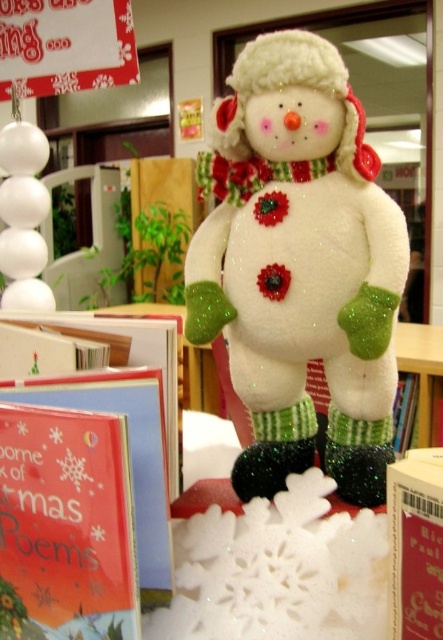
Can you confirm if fuzzy white snowman at center is shorter than matte red card at center?

Incorrect, fuzzy white snowman at center's height does not fall short of matte red card at center's.

Which is below, fuzzy white snowman at center or matte red card at center?

Positioned lower is matte red card at center.

Is point (265, 276) positioned behind point (15, 316)?

No, (265, 276) is in front of (15, 316).

This screenshot has width=443, height=640. I want to click on fuzzy white snowman at center, so click(299, 266).

Can you confirm if fuzzy white snowman at center is shorter than white paper book at center?

No, fuzzy white snowman at center is not shorter than white paper book at center.

Who is shorter, fuzzy white snowman at center or white paper book at center?

Standing shorter between the two is white paper book at center.

Does point (252, 422) come in front of point (403, 528)?

No.

The image size is (443, 640). I want to click on fuzzy white snowman at center, so click(299, 266).

Is point (170, 422) closer to camera compared to point (439, 589)?

No, it is not.

Describe the element at coordinates (127, 419) in the screenshot. I see `matte red card at center` at that location.

Is point (148, 518) positioned in front of point (434, 476)?

No, (148, 518) is behind (434, 476).

The height and width of the screenshot is (640, 443). In order to click on matte red card at center in this screenshot , I will do `click(127, 419)`.